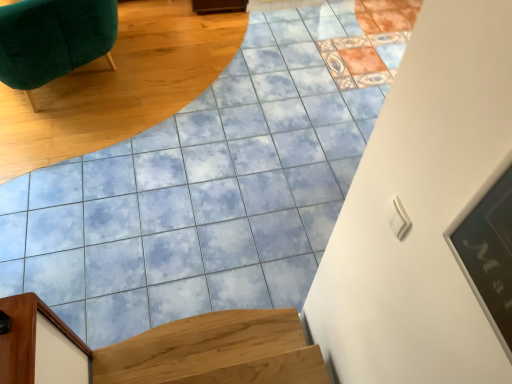
What is the approximate height of wooden door frame at lower left, which appears as the 1th furniture when viewed from the front?

33.01 inches.

I want to click on wooden door frame at lower left, positioned as the second furniture in top-to-bottom order, so click(x=40, y=345).

Considering the relative sizes of velvet green chair at upper left, which is the first furniture in left-to-right order, and wooden door frame at lower left, positioned as the second furniture in top-to-bottom order, in the image provided, is velvet green chair at upper left, which is the first furniture in left-to-right order, taller than wooden door frame at lower left, positioned as the second furniture in top-to-bottom order,?

No, velvet green chair at upper left, which is the first furniture in left-to-right order, is not taller than wooden door frame at lower left, positioned as the second furniture in top-to-bottom order.

Where is `furniture behind the wooden door frame at lower left, positioned as the second furniture in top-to-bottom order`? The height and width of the screenshot is (384, 512). furniture behind the wooden door frame at lower left, positioned as the second furniture in top-to-bottom order is located at coordinates (53, 39).

Between velvet green chair at upper left, which ranks as the 2th furniture in bottom-to-top order, and wooden door frame at lower left, the first furniture in the bottom-to-top sequence, which one appears on the right side from the viewer's perspective?

wooden door frame at lower left, the first furniture in the bottom-to-top sequence.

Looking at this image, from the image's perspective, does light brown wood stairs at lower left appear lower than velvet green chair at upper left, which ranks as the 2th furniture in bottom-to-top order?

Indeed, from the image's perspective, light brown wood stairs at lower left is shown beneath velvet green chair at upper left, which ranks as the 2th furniture in bottom-to-top order.

Is light brown wood stairs at lower left looking in the opposite direction of velvet green chair at upper left, positioned as the second furniture in front-to-back order?

light brown wood stairs at lower left is not turned away from velvet green chair at upper left, positioned as the second furniture in front-to-back order.

From a real-world perspective, between light brown wood stairs at lower left and velvet green chair at upper left, the first furniture when ordered from top to bottom, who is vertically higher?

velvet green chair at upper left, the first furniture when ordered from top to bottom.

Could you tell me if velvet green chair at upper left, which is the first furniture in left-to-right order, is turned towards light brown wood stairs at lower left?

No, velvet green chair at upper left, which is the first furniture in left-to-right order, does not turn towards light brown wood stairs at lower left.

From the picture: In terms of width, does velvet green chair at upper left, which is the first furniture in left-to-right order, look wider or thinner when compared to light brown wood stairs at lower left?

In the image, velvet green chair at upper left, which is the first furniture in left-to-right order, appears to be wider than light brown wood stairs at lower left.

Considering the points (18, 307) and (241, 339), which point is behind, point (18, 307) or point (241, 339)?

The point (241, 339) is farther from the camera.

Which object is closer to the camera taking this photo, wooden door frame at lower left, positioned as the second furniture in top-to-bottom order, or light brown wood stairs at lower left?

wooden door frame at lower left, positioned as the second furniture in top-to-bottom order, is closer to the camera.

Is wooden door frame at lower left, positioned as the second furniture in top-to-bottom order, far from light brown wood stairs at lower left?

No.

How different are the orientations of wooden door frame at lower left, positioned as the second furniture in back-to-front order, and velvet green chair at upper left, positioned as the second furniture in front-to-back order, in degrees?

There is a 29.2-degree angle between the facing directions of wooden door frame at lower left, positioned as the second furniture in back-to-front order, and velvet green chair at upper left, positioned as the second furniture in front-to-back order.

Who is shorter, wooden door frame at lower left, which appears as the 1th furniture when viewed from the front, or velvet green chair at upper left, positioned as the second furniture in front-to-back order?

With less height is velvet green chair at upper left, positioned as the second furniture in front-to-back order.

Considering the relative sizes of wooden door frame at lower left, positioned as the second furniture in back-to-front order, and velvet green chair at upper left, positioned as the second furniture in front-to-back order, in the image provided, is wooden door frame at lower left, positioned as the second furniture in back-to-front order, smaller than velvet green chair at upper left, positioned as the second furniture in front-to-back order,?

Yes.

Is wooden door frame at lower left, positioned as the second furniture in top-to-bottom order, turned away from velvet green chair at upper left, which is counted as the 1th furniture, starting from the back?

No.

Based on the photo, considering the relative positions of light brown wood stairs at lower left and wooden door frame at lower left, which appears as the 1th furniture when viewed from the front, in the image provided, is light brown wood stairs at lower left to the right of wooden door frame at lower left, which appears as the 1th furniture when viewed from the front, from the viewer's perspective?

Yes, light brown wood stairs at lower left is to the right of wooden door frame at lower left, which appears as the 1th furniture when viewed from the front.

Who is bigger, light brown wood stairs at lower left or wooden door frame at lower left, the first furniture in the bottom-to-top sequence?

light brown wood stairs at lower left.

Does light brown wood stairs at lower left contain wooden door frame at lower left, positioned as the second furniture in top-to-bottom order?

Definitely not — wooden door frame at lower left, positioned as the second furniture in top-to-bottom order, is not inside light brown wood stairs at lower left.

In the image, there is a wooden door frame at lower left, which is the first furniture in right-to-left order. At what (x,y) coordinates should I click in order to perform the action: click on furniture above it (from the image's perspective). Please return your answer as a coordinate pair (x, y). The image size is (512, 384). Looking at the image, I should click on (53, 39).

Image resolution: width=512 pixels, height=384 pixels. I want to click on stairs that appears below the velvet green chair at upper left, which is the first furniture in left-to-right order (from the image's perspective), so click(x=216, y=351).

Estimate the real-world distances between objects in this image. Which object is further from light brown wood stairs at lower left, wooden door frame at lower left, the first furniture in the bottom-to-top sequence, or velvet green chair at upper left, which is counted as the 1th furniture, starting from the back?

The object further to light brown wood stairs at lower left is velvet green chair at upper left, which is counted as the 1th furniture, starting from the back.

Based on their spatial positions, is velvet green chair at upper left, the 2th furniture positioned from the right, or light brown wood stairs at lower left further from wooden door frame at lower left, the first furniture in the bottom-to-top sequence?

velvet green chair at upper left, the 2th furniture positioned from the right, is positioned further to the anchor wooden door frame at lower left, the first furniture in the bottom-to-top sequence.

Considering their positions, is light brown wood stairs at lower left positioned further to velvet green chair at upper left, the first furniture when ordered from top to bottom, than wooden door frame at lower left, the first furniture in the bottom-to-top sequence?

Result: Among the two, light brown wood stairs at lower left is located further to velvet green chair at upper left, the first furniture when ordered from top to bottom.

Considering their positions, is light brown wood stairs at lower left positioned closer to wooden door frame at lower left, the first furniture in the bottom-to-top sequence, than velvet green chair at upper left, the 2th furniture positioned from the right?

light brown wood stairs at lower left is closer to wooden door frame at lower left, the first furniture in the bottom-to-top sequence.

Based on their spatial positions, is wooden door frame at lower left, positioned as the second furniture in back-to-front order, or light brown wood stairs at lower left further from velvet green chair at upper left, which ranks as the 2th furniture in bottom-to-top order?

light brown wood stairs at lower left.

Based on their spatial positions, is velvet green chair at upper left, the first furniture when ordered from top to bottom, or wooden door frame at lower left, placed as the 2th furniture when sorted from left to right, further from light brown wood stairs at lower left?

Based on the image, velvet green chair at upper left, the first furniture when ordered from top to bottom, appears to be further to light brown wood stairs at lower left.

Identify the location of furniture between velvet green chair at upper left, which is the first furniture in left-to-right order, and light brown wood stairs at lower left from top to bottom. (40, 345).